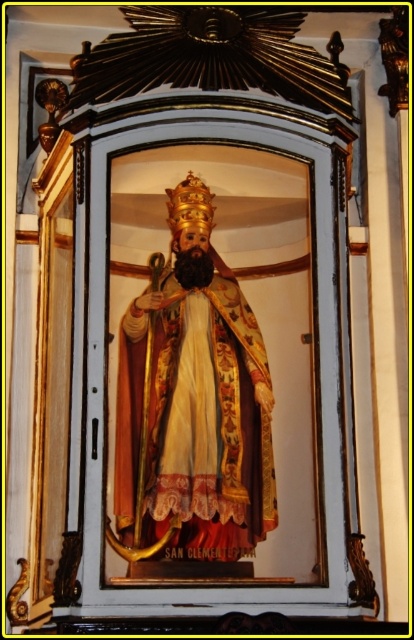
Question: Is goldmaterial/texture statue at center thinner than gold textured crown at center?

Choices:
 (A) no
 (B) yes

Answer: (A)

Question: Is goldmaterial/texture statue at center further to camera compared to gold textured crown at center?

Choices:
 (A) yes
 (B) no

Answer: (B)

Question: Does goldmaterial/texture statue at center have a greater width compared to gold textured crown at center?

Choices:
 (A) yes
 (B) no

Answer: (A)

Question: Which point is closer to the camera taking this photo?

Choices:
 (A) (194, 189)
 (B) (194, 317)

Answer: (B)

Question: Which point is closer to the camera?

Choices:
 (A) (197, 188)
 (B) (214, 492)

Answer: (B)

Question: Which of the following is the closest to the observer?

Choices:
 (A) (158, 538)
 (B) (187, 212)

Answer: (A)